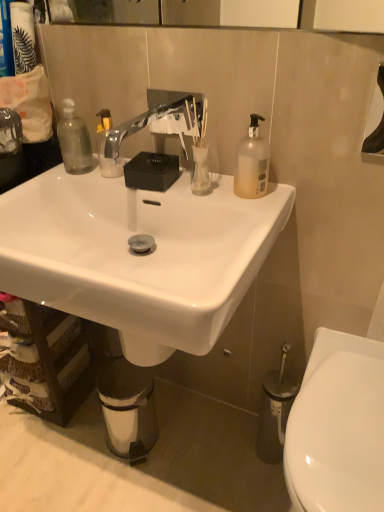
The height and width of the screenshot is (512, 384). In order to click on vacant space underneath metallic silver trash can at lower center (from a real-world perspective) in this screenshot , I will do `click(139, 434)`.